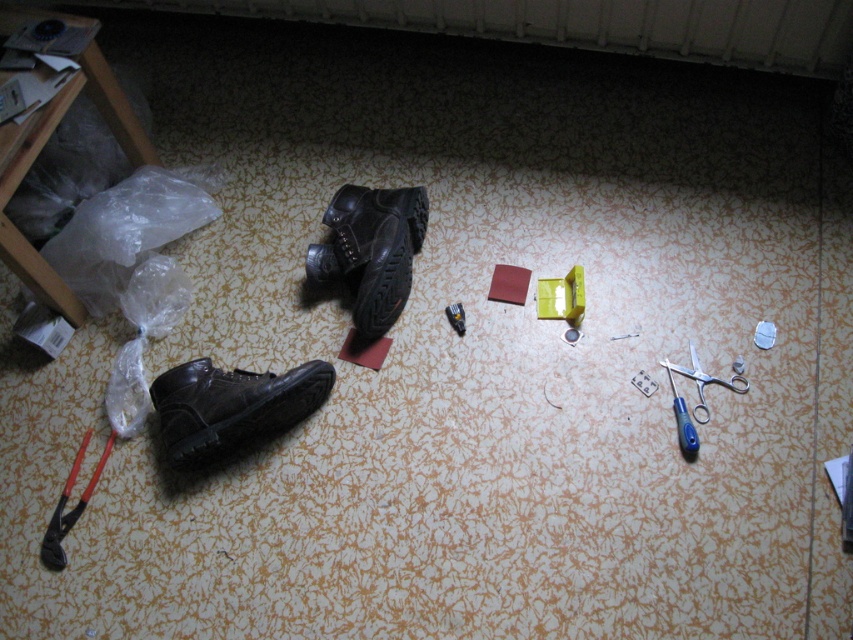
Question: Is black leather boot at lower left above black rubber pliers at lower left?

Choices:
 (A) no
 (B) yes

Answer: (B)

Question: Estimate the real-world distances between objects in this image. Which object is farther from the blue plastic scissors at lower right?

Choices:
 (A) black leather boot at lower left
 (B) yellow plastic toy at center
 (C) black rubber pliers at lower left
 (D) leather shoe at center

Answer: (C)

Question: Which object is positioned closest to the yellow plastic toy at center?

Choices:
 (A) black leather boot at lower left
 (B) blue plastic scissors at lower right
 (C) leather shoe at center

Answer: (B)

Question: Considering the relative positions of leather shoe at center and yellow plastic toy at center in the image provided, where is leather shoe at center located with respect to yellow plastic toy at center?

Choices:
 (A) above
 (B) below

Answer: (A)

Question: Which point appears farthest from the camera in this image?

Choices:
 (A) (583, 292)
 (B) (386, 241)

Answer: (B)

Question: In this image, where is black rubber pliers at lower left located relative to yellow plastic toy at center?

Choices:
 (A) below
 (B) above

Answer: (A)